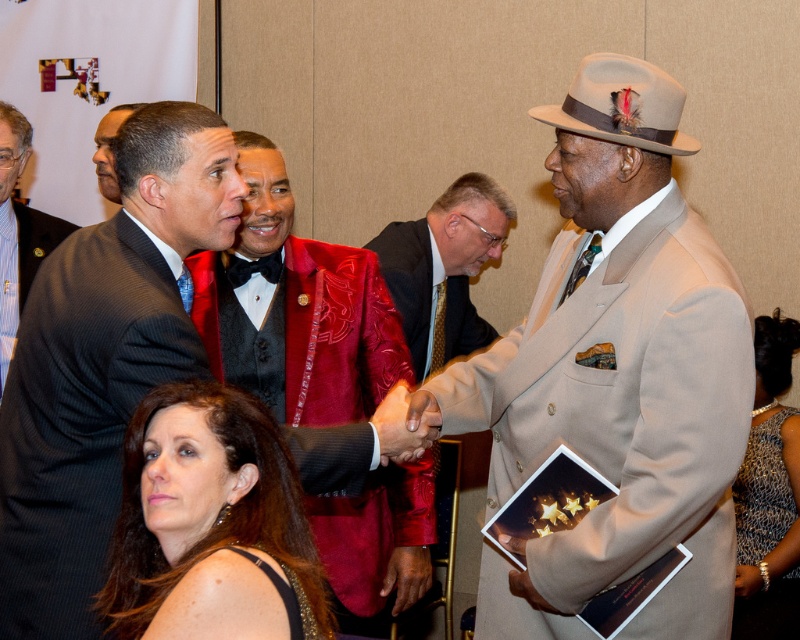
You are standing at the entrance of the room and want to greet both the man in the beige wool suit at center and the man in the dark gray pinstripe suit at left. Which one should you approach first if you want to greet the person who is closer to the entrance?

The dark gray pinstripe suit at left is closer to the entrance than the beige wool suit at center, so you should approach the dark gray pinstripe suit at left first.

What are the coordinates of the dark gray pinstripe suit at left?

The dark gray pinstripe suit at left is located at coordinates point [80,417].